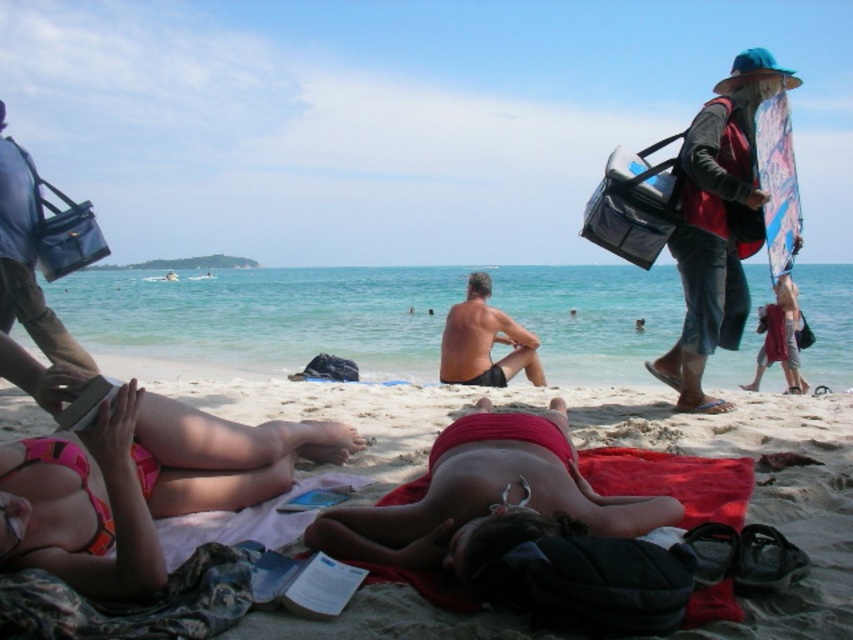
You are a lifeguard on duty and need to locate the matte red towel at center quickly. Based on the coordinates provided in the scene description, where should you look to find it?

The matte red towel at center is located at point (590, 445).

You are a photographer at the beach and want to take a photo of the smooth skin man at center without including the red fabric bag at right in the frame. Based on their positions, is this possible?

The red fabric bag at right is to the right of the smooth skin man at center, so if you position yourself to the left side of the smooth skin man at center, you can capture the man without the bag appearing in the frame.